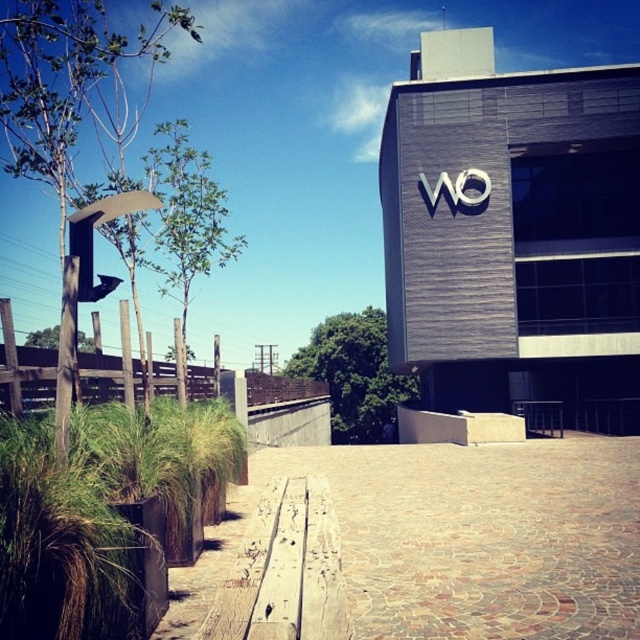
Question: Is brown textured pavement at center bigger than green grass at lower left?

Choices:
 (A) yes
 (B) no

Answer: (A)

Question: Among these points, which one is farthest from the camera?

Choices:
 (A) (170, 513)
 (B) (435, 582)

Answer: (B)

Question: Is brown textured pavement at center positioned behind green grass at lower left?

Choices:
 (A) no
 (B) yes

Answer: (B)

Question: Which object is closer to the camera taking this photo?

Choices:
 (A) green grass at lower left
 (B) brown textured pavement at center

Answer: (A)

Question: Can you confirm if brown textured pavement at center is positioned above green grass at lower left?

Choices:
 (A) no
 (B) yes

Answer: (A)